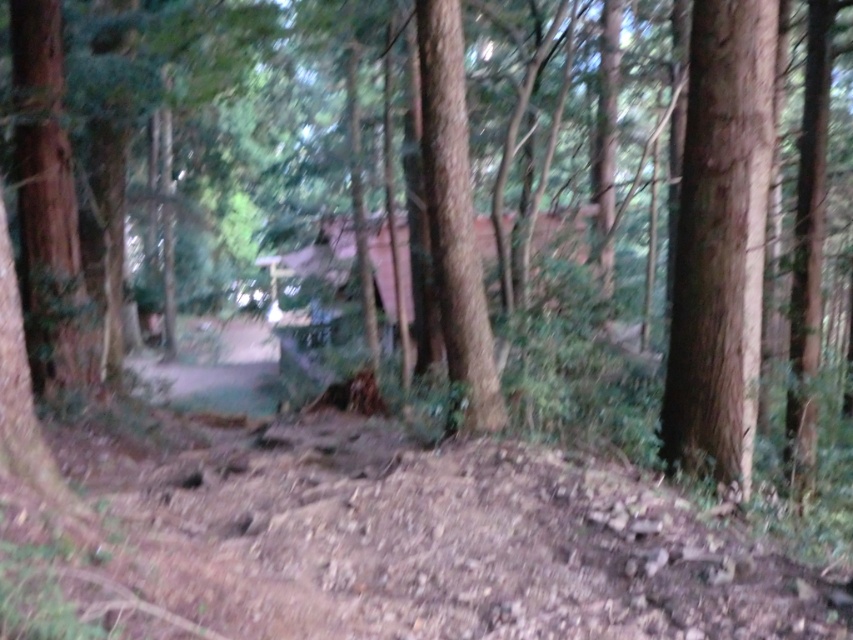
You are standing at the starting point of the forest path. You see two points marked in the scene. The first point is at coordinates point (462, 611) and the second point is at point (737, 13). Which point is closer to you?

Point (462, 611) is in front of point (737, 13), so the first point is closer to you.

You are standing at the point marked by the coordinates point (386, 544) in the forest scene. What is the terrain like under your feet?

The terrain under your feet at point (386, 544) is brown dirt track at lower center, which is a natural path through the forest.

You are a hiker carrying a 2.5 meters long wooden pole. You see the smooth brown tree trunk at right and the smooth brown tree trunk at center. Can you fit the pole horizontally between them without bending it?

The distance between the smooth brown tree trunk at right and the smooth brown tree trunk at center is 1.77 meters. Since the pole is 2.5 meters long, it cannot fit horizontally between them without bending.